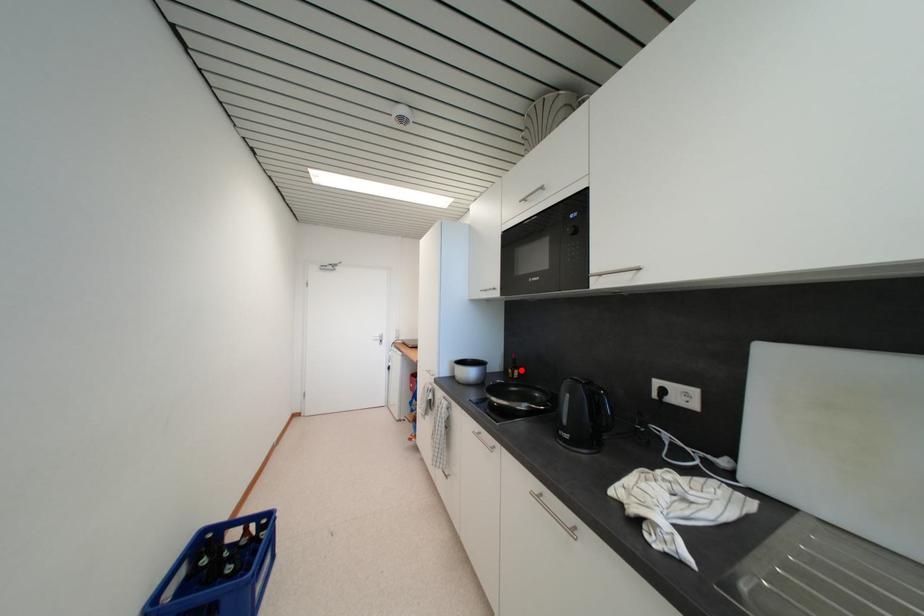
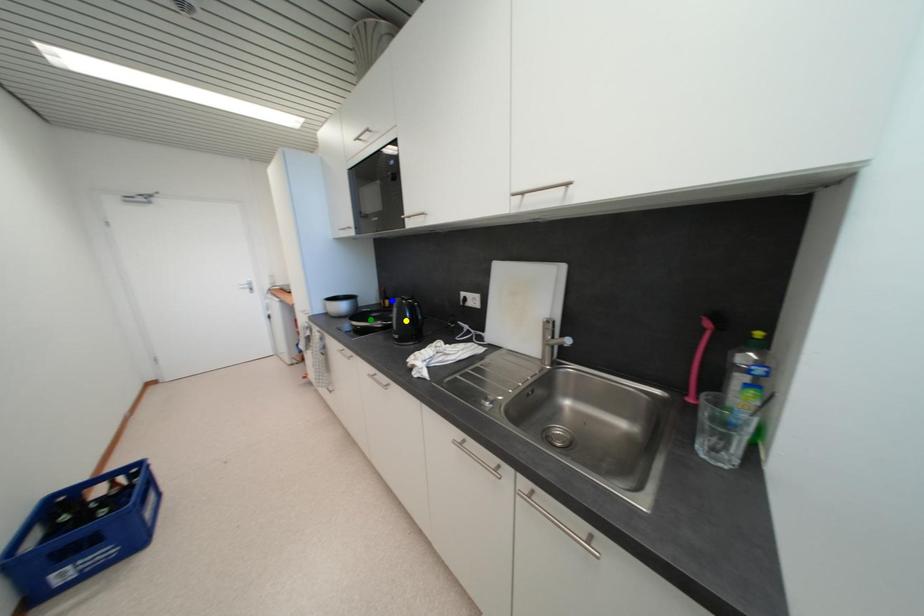
Question: I am providing you with two images of the same scene from different viewpoints. A red point is marked on the first image. You are given multiple points on the second image. In image 2, which mark is for the same physical point as the one in image 1?

Choices:
 (A) blue point
 (B) green point
 (C) yellow point

Answer: (A)